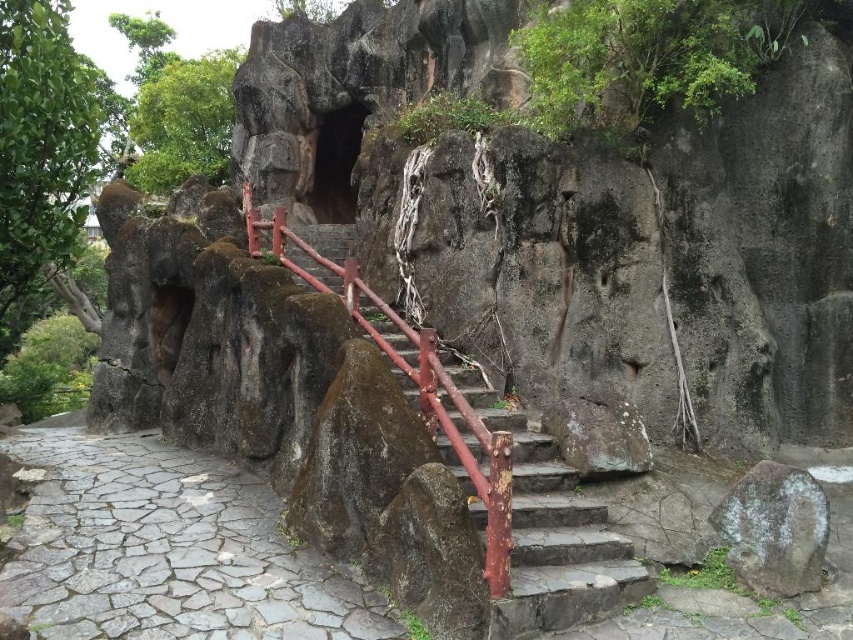
Can you confirm if gray stone path at lower left is wider than gray rough rock at lower right?

Correct, the width of gray stone path at lower left exceeds that of gray rough rock at lower right.

Which is in front, point (305, 552) or point (804, 576)?

Point (804, 576) is in front.

Which is behind, point (131, 545) or point (722, 499)?

The point (722, 499) is behind.

Where is `gray stone path at lower left`? gray stone path at lower left is located at coordinates (167, 548).

Between rusty metal stairs at center and gray rough rock at lower right, which one appears on the right side from the viewer's perspective?

gray rough rock at lower right is more to the right.

Can you confirm if rusty metal stairs at center is thinner than gray rough rock at lower right?

In fact, rusty metal stairs at center might be wider than gray rough rock at lower right.

Is point (532, 588) positioned after point (752, 508)?

No, (532, 588) is closer to viewer.

The width and height of the screenshot is (853, 640). Find the location of `rusty metal stairs at center`. rusty metal stairs at center is located at coordinates (550, 529).

Who is lower down, gray stone path at lower left or rusty metal stairs at center?

gray stone path at lower left

From the picture: Is gray stone path at lower left taller than rusty metal stairs at center?

In fact, gray stone path at lower left may be shorter than rusty metal stairs at center.

At what (x,y) coordinates should I click in order to perform the action: click on gray stone path at lower left. Please return your answer as a coordinate pair (x, y). This screenshot has height=640, width=853. Looking at the image, I should click on point(167,548).